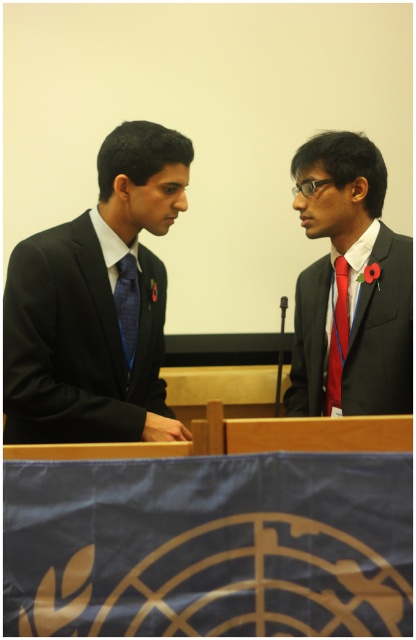
Describe the element at coordinates (349, 285) in the screenshot. This screenshot has width=416, height=640. I see `matte black suit at center` at that location.

Does matte black suit at center have a greater height compared to blue satin tie at left?

Answer: Yes, matte black suit at center is taller than blue satin tie at left.

This screenshot has width=416, height=640. I want to click on matte black suit at center, so click(x=349, y=285).

Where is `matte black suit at center`? matte black suit at center is located at coordinates (349, 285).

Can you confirm if matte black suit at left is positioned below red satin tie at right?

Incorrect, matte black suit at left is not positioned below red satin tie at right.

Is point (86, 436) positioned before point (339, 392)?

Yes, point (86, 436) is in front of point (339, 392).

Where is `matte black suit at left`? The image size is (416, 640). matte black suit at left is located at coordinates (96, 305).

Does point (143, 380) lie in front of point (129, 308)?

No, it is behind (129, 308).

The height and width of the screenshot is (640, 416). Describe the element at coordinates (96, 305) in the screenshot. I see `matte black suit at left` at that location.

Which is behind, point (56, 264) or point (131, 317)?

The point (131, 317) is more distant.

Where is `matte black suit at left`? This screenshot has width=416, height=640. matte black suit at left is located at coordinates (96, 305).